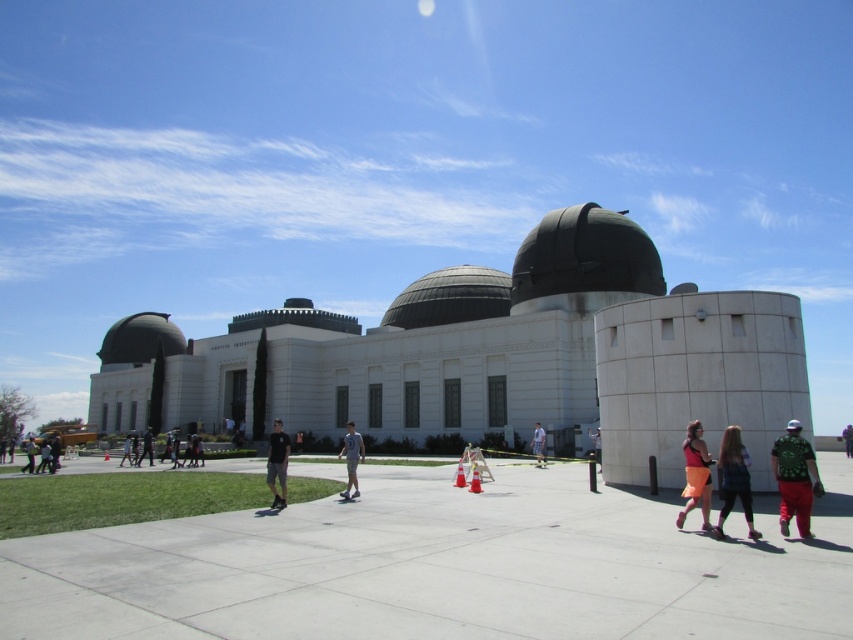
Question: Which object appears farthest from the camera in this image?

Choices:
 (A) matte black dome at left
 (B) matte gray dome at center
 (C) black textured dome at center
 (D) dark brown leather jacket at lower right

Answer: (B)

Question: Can you confirm if orange skirt at lower right is positioned to the left of green fabric shorts at center?

Choices:
 (A) no
 (B) yes

Answer: (A)

Question: Which object is farther from the camera taking this photo?

Choices:
 (A) orange skirt at lower right
 (B) gray fabric pants at center

Answer: (B)

Question: Which point appears closest to the camera in this image?

Choices:
 (A) (737, 436)
 (B) (583, 275)

Answer: (A)

Question: Can you confirm if black fabric pants at lower left is positioned below green fabric shirt at lower right?

Choices:
 (A) yes
 (B) no

Answer: (A)

Question: Is dark brown leather jacket at lower right wider than orange skirt at lower right?

Choices:
 (A) no
 (B) yes

Answer: (B)